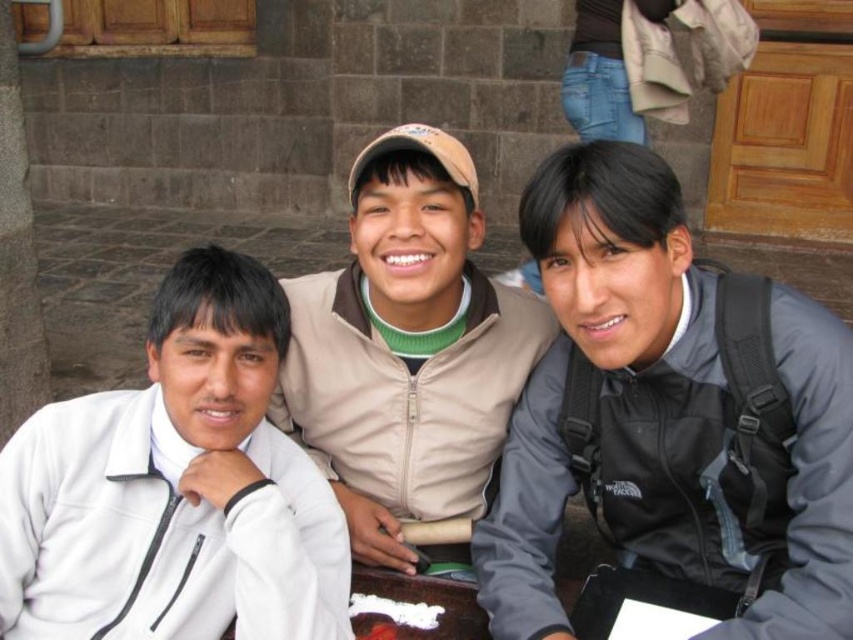
Does gray matte jacket at center have a lesser width compared to beige fleece jacket at center?

Correct, gray matte jacket at center's width is less than beige fleece jacket at center's.

Can you confirm if gray matte jacket at center is positioned to the right of beige fleece jacket at center?

Yes, gray matte jacket at center is to the right of beige fleece jacket at center.

Is point (685, 252) more distant than point (403, 252)?

No, (685, 252) is in front of (403, 252).

You are a GUI agent. You are given a task and a screenshot of the screen. Output one action in this format:
    pyautogui.click(x=<x>, y=<y>)
    Task: Click on the gray matte jacket at center
    
    Given the screenshot: What is the action you would take?
    pyautogui.click(x=614, y=392)

Which is above, gray matte jacket at center or white matte jacket at left?

gray matte jacket at center is higher up.

Is gray matte jacket at center to the left of white matte jacket at left from the viewer's perspective?

In fact, gray matte jacket at center is to the right of white matte jacket at left.

This screenshot has width=853, height=640. In order to click on gray matte jacket at center in this screenshot , I will do `click(614, 392)`.

Is white matte jacket at left positioned before beige fleece jacket at center?

That is True.

Between white matte jacket at left and beige fleece jacket at center, which one appears on the right side from the viewer's perspective?

beige fleece jacket at center

Is point (131, 390) in front of point (392, 316)?

Yes.

Find the location of a particular element. This screenshot has height=640, width=853. white matte jacket at left is located at coordinates (175, 486).